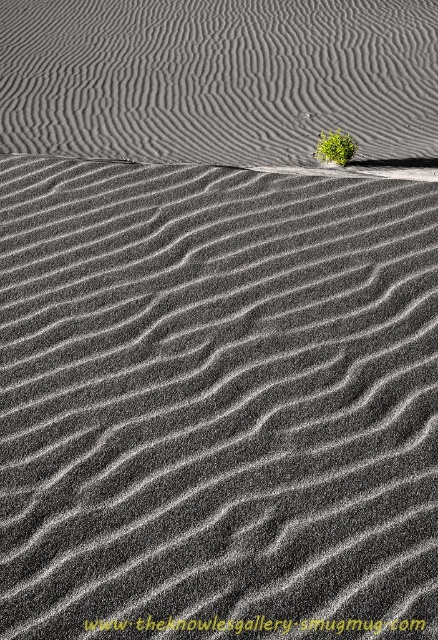
Consider the image. Which of these two, gray textured sand at upper center or green leafy plant at upper center, stands taller?

Standing taller between the two is gray textured sand at upper center.

Does gray textured sand at upper center lie behind green leafy plant at upper center?

That is False.

Is point (127, 45) less distant than point (352, 150)?

No, (127, 45) is further to viewer.

What are the coordinates of `gray textured sand at upper center` in the screenshot? It's located at (218, 77).